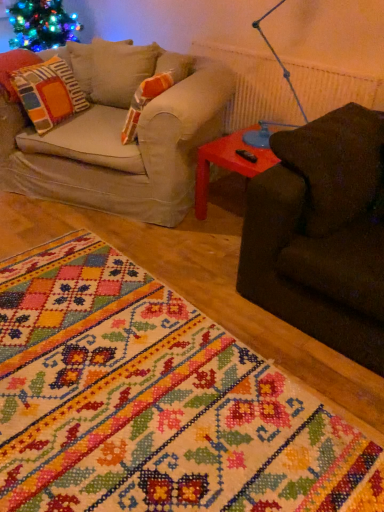
Question: Is multicolored fabric pillow at left to the right of embroidered fabric rug at lower left from the viewer's perspective?

Choices:
 (A) yes
 (B) no

Answer: (B)

Question: Does multicolored fabric pillow at left have a larger size compared to embroidered fabric rug at lower left?

Choices:
 (A) yes
 (B) no

Answer: (B)

Question: Considering the relative sizes of multicolored fabric pillow at left and embroidered fabric rug at lower left in the image provided, is multicolored fabric pillow at left taller than embroidered fabric rug at lower left?

Choices:
 (A) no
 (B) yes

Answer: (B)

Question: From a real-world perspective, is multicolored fabric pillow at left positioned under embroidered fabric rug at lower left based on gravity?

Choices:
 (A) no
 (B) yes

Answer: (A)

Question: Considering the relative sizes of multicolored fabric pillow at left and embroidered fabric rug at lower left in the image provided, is multicolored fabric pillow at left wider than embroidered fabric rug at lower left?

Choices:
 (A) no
 (B) yes

Answer: (A)

Question: Is multicolored fabric pillow at left aimed at embroidered fabric rug at lower left?

Choices:
 (A) no
 (B) yes

Answer: (A)

Question: Is rubberized plastic side table at right a part of multicolored fabric pillow at left?

Choices:
 (A) yes
 (B) no

Answer: (B)

Question: Can you confirm if multicolored fabric pillow at left is shorter than rubberized plastic side table at right?

Choices:
 (A) yes
 (B) no

Answer: (B)

Question: Is multicolored fabric pillow at left smaller than rubberized plastic side table at right?

Choices:
 (A) yes
 (B) no

Answer: (A)

Question: Can you confirm if multicolored fabric pillow at left is positioned to the left of rubberized plastic side table at right?

Choices:
 (A) no
 (B) yes

Answer: (B)

Question: Is multicolored fabric pillow at left to the right of rubberized plastic side table at right from the viewer's perspective?

Choices:
 (A) no
 (B) yes

Answer: (A)

Question: Considering the relative positions of multicolored fabric pillow at left and rubberized plastic side table at right in the image provided, is multicolored fabric pillow at left behind rubberized plastic side table at right?

Choices:
 (A) no
 (B) yes

Answer: (B)

Question: Is embroidered fabric rug at lower left outside rubberized plastic side table at right?

Choices:
 (A) yes
 (B) no

Answer: (A)